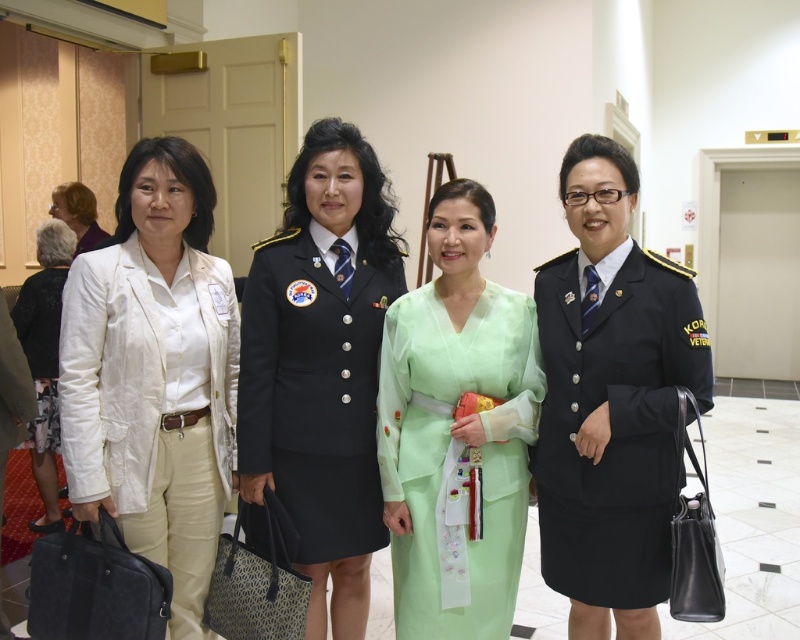
Question: Which point is farther from the camera taking this photo?

Choices:
 (A) (92, 220)
 (B) (705, 397)
 (C) (114, 301)

Answer: (A)

Question: From the image, what is the correct spatial relationship of light green silk dress at center in relation to light beige pantsuit at left?

Choices:
 (A) above
 (B) below

Answer: (B)

Question: Is light green silk dress at center in front of navy blue uniform at center?

Choices:
 (A) no
 (B) yes

Answer: (B)

Question: Which point appears farthest from the camera in this image?

Choices:
 (A) (618, 592)
 (B) (448, 525)
 (C) (61, 209)
 (D) (345, 508)

Answer: (C)

Question: Is white linen blazer at left closer to the viewer compared to dark blue uniform at right?

Choices:
 (A) yes
 (B) no

Answer: (B)

Question: Estimate the real-world distances between objects in this image. Which object is farther from the white linen blazer at left?

Choices:
 (A) dark blue uniform at right
 (B) light beige pantsuit at left
 (C) navy blue uniform at center

Answer: (B)